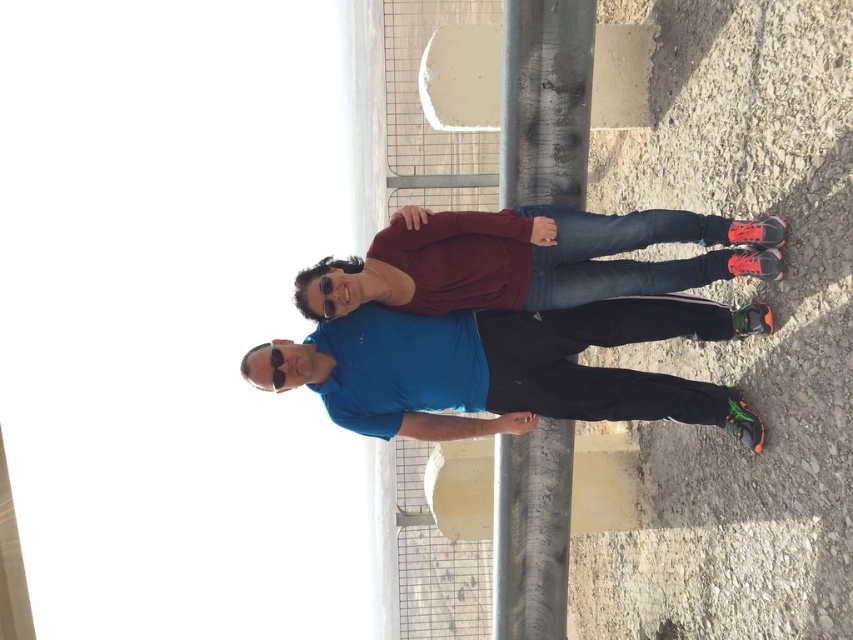
Consider the image. You are taking a photo of the blue matte shirt at center and the metallic gray pole at center. Which one is positioned to the left of the other?

The blue matte shirt at center is positioned to the left of the metallic gray pole at center.

You are taking a photo of two people standing on a gravel area at a construction site. You notice two points in the image labeled as point (547, 296) and point (537, 157). Based on their positions, which point is nearer to you?

Point (547, 296) is closer to the viewer than point (537, 157).